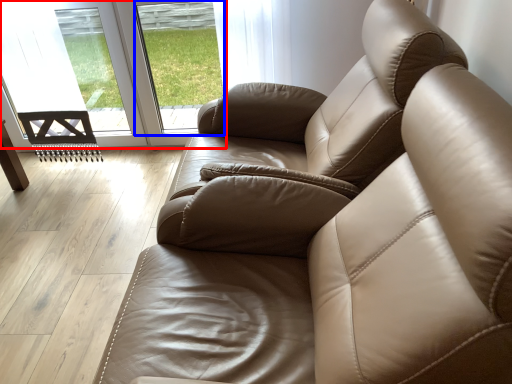
Question: Among these objects, which one is nearest to the camera, glass door (highlighted by a red box) or window (highlighted by a blue box)?

Choices:
 (A) glass door
 (B) window

Answer: (B)